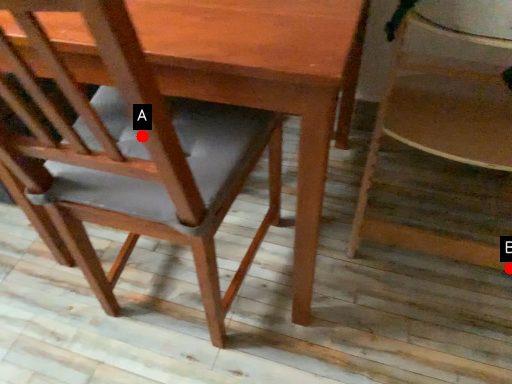
Question: Two points are circled on the image, labeled by A and B beside each circle. Which of the following is the closest to the observer?

Choices:
 (A) A is closer
 (B) B is closer

Answer: (A)